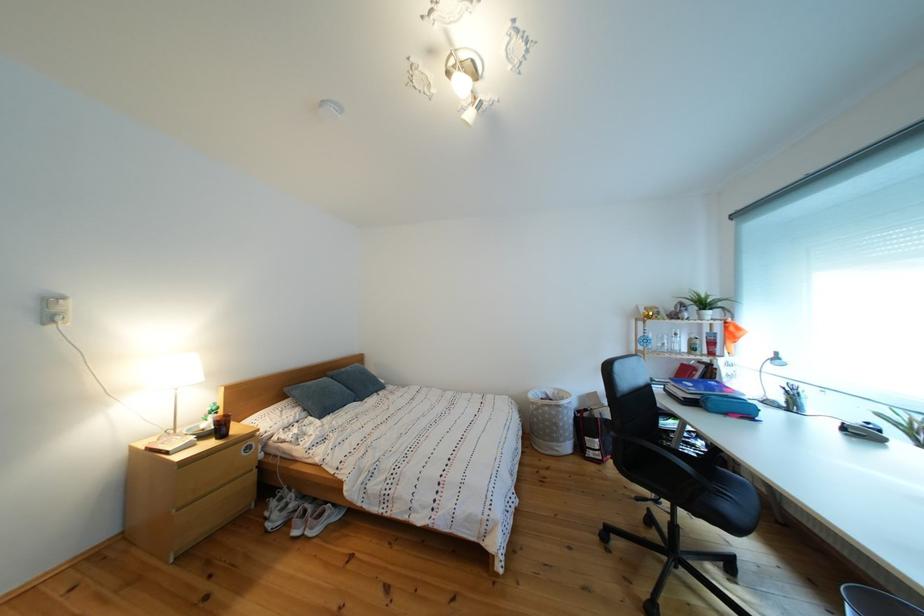
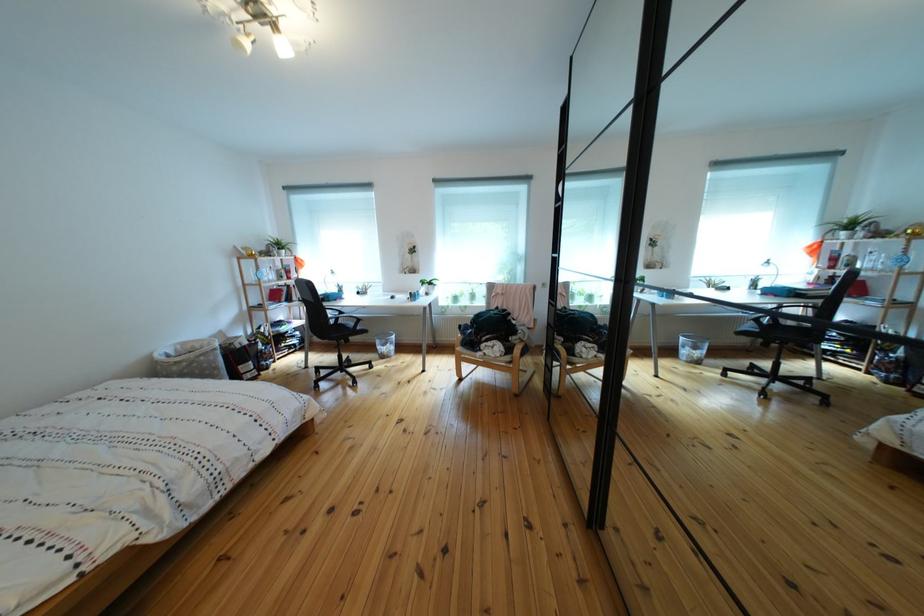
The point at (683, 358) is marked in the first image. Where is the corresponding point in the second image?

(282, 286)